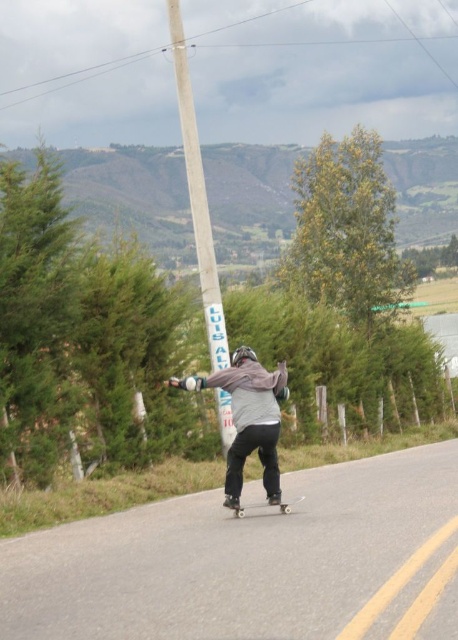
Question: Which of the following is the closest to the observer?

Choices:
 (A) white plastic skateboard at center
 (B) gray fleece jacket at center

Answer: (B)

Question: Is gray fleece jacket at center below white plastic skateboard at center?

Choices:
 (A) no
 (B) yes

Answer: (A)

Question: Which of the following is the closest to the observer?

Choices:
 (A) 234,397
 (B) 260,502

Answer: (A)

Question: Is gray fleece jacket at center to the right of white plastic skateboard at center from the viewer's perspective?

Choices:
 (A) yes
 (B) no

Answer: (B)

Question: Can you confirm if gray fleece jacket at center is positioned above white plastic skateboard at center?

Choices:
 (A) no
 (B) yes

Answer: (B)